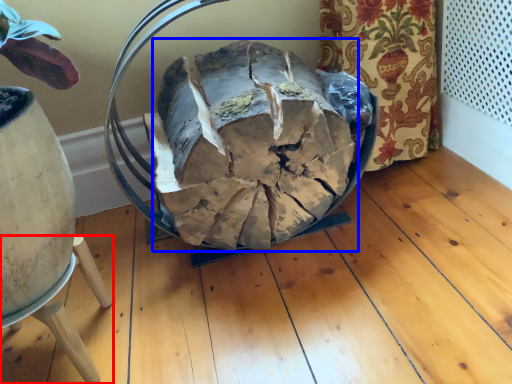
Question: Which object appears closest to the camera in this image, furniture (highlighted by a red box) or food (highlighted by a blue box)?

Choices:
 (A) furniture
 (B) food

Answer: (A)